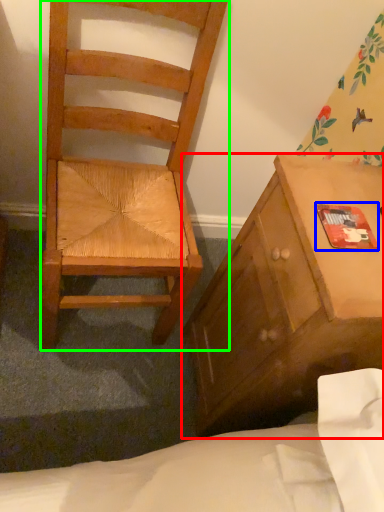
Question: Which is farther away from cabinetry (highlighted by a red box)? paperback book (highlighted by a blue box) or chair (highlighted by a green box)?

Choices:
 (A) paperback book
 (B) chair

Answer: (B)